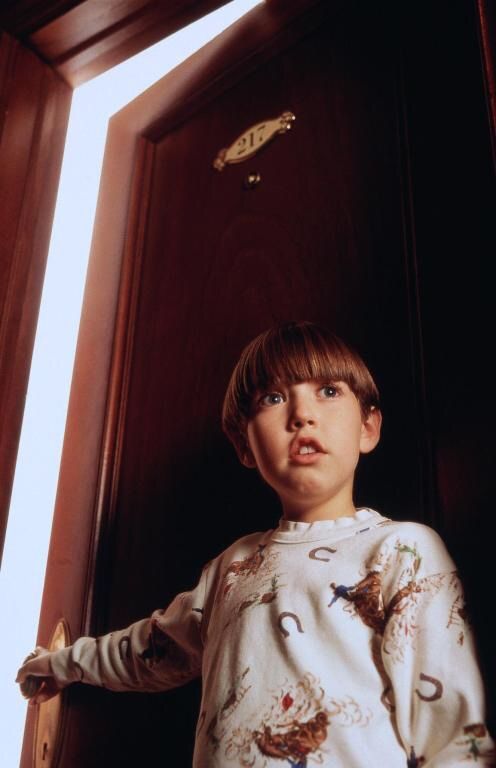
Identify the location of door. pos(67,577).